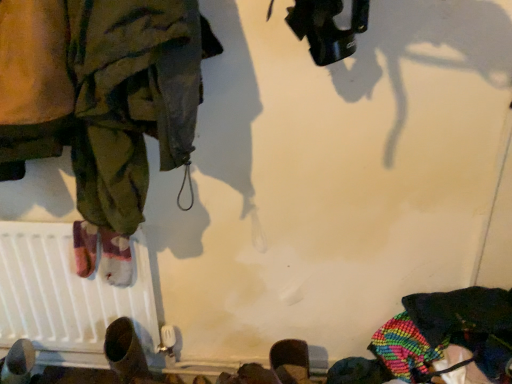
Question: Looking at the image, does brown leather shoe at lower left seem bigger or smaller compared to camouflage fabric pants at left?

Choices:
 (A) small
 (B) big

Answer: (A)

Question: Considering the positions of brown leather shoe at lower left and camouflage fabric pants at left in the image, is brown leather shoe at lower left taller or shorter than camouflage fabric pants at left?

Choices:
 (A) short
 (B) tall

Answer: (A)

Question: Considering the real-world distances, which object is closest to the camouflage fabric pants at left?

Choices:
 (A) brown leather shoe at lower left
 (B) white matte radiator at lower left

Answer: (B)

Question: Which of these objects is positioned farthest from the brown leather shoe at lower left?

Choices:
 (A) camouflage fabric pants at left
 (B) white matte radiator at lower left

Answer: (A)